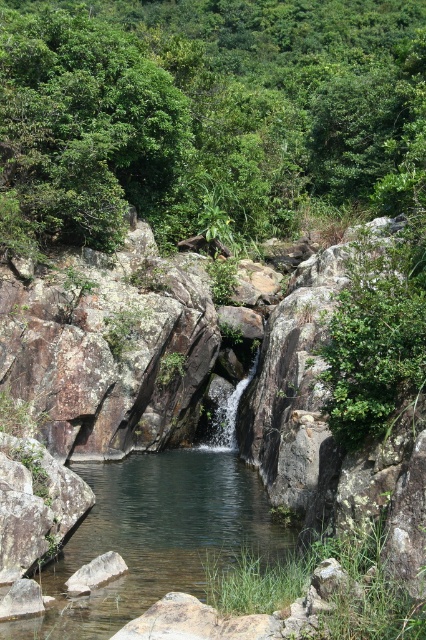
Can you confirm if green leafy tree at upper center is wider than clear water stream at center?

Correct, the width of green leafy tree at upper center exceeds that of clear water stream at center.

Identify the location of green leafy tree at upper center. This screenshot has height=640, width=426. (206, 115).

Looking at this image, who is more distant from viewer, (36, 36) or (149, 600)?

Positioned behind is point (36, 36).

This screenshot has height=640, width=426. I want to click on green leafy tree at upper center, so click(206, 115).